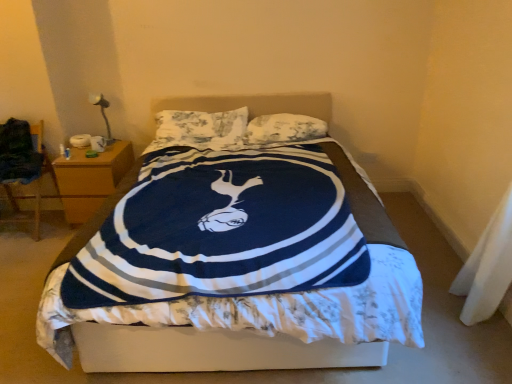
Question: Is white fabric at lower right to the left of fluffy white pillow at center, which is the 1th pillow in right-to-left order, from the viewer's perspective?

Choices:
 (A) no
 (B) yes

Answer: (A)

Question: Can you confirm if white fabric at lower right is bigger than fluffy white pillow at center, which is the 1th pillow in right-to-left order?

Choices:
 (A) no
 (B) yes

Answer: (A)

Question: Does white fabric at lower right have a greater width compared to fluffy white pillow at center, which is the 1th pillow in right-to-left order?

Choices:
 (A) no
 (B) yes

Answer: (A)

Question: Is white fabric at lower right shorter than fluffy white pillow at center, which is the 1th pillow in right-to-left order?

Choices:
 (A) no
 (B) yes

Answer: (B)

Question: From a real-world perspective, is white fabric at lower right under fluffy white pillow at center, which is the 1th pillow in right-to-left order?

Choices:
 (A) yes
 (B) no

Answer: (A)

Question: From a real-world perspective, is metallic silver table lamp at upper left positioned above or below white fabric at lower right?

Choices:
 (A) above
 (B) below

Answer: (A)

Question: In terms of size, does metallic silver table lamp at upper left appear bigger or smaller than white fabric at lower right?

Choices:
 (A) small
 (B) big

Answer: (B)

Question: Is point (104, 120) positioned closer to the camera than point (476, 254)?

Choices:
 (A) closer
 (B) farther

Answer: (B)

Question: In terms of height, does metallic silver table lamp at upper left look taller or shorter compared to white fabric at lower right?

Choices:
 (A) tall
 (B) short

Answer: (A)

Question: Looking at the image, does fluffy white pillow at center, placed as the first pillow when sorted from left to right, seem bigger or smaller compared to fluffy white pillow at center, which is the 1th pillow in right-to-left order?

Choices:
 (A) big
 (B) small

Answer: (A)

Question: In the image, is fluffy white pillow at center, the second pillow viewed from the right, on the left side or the right side of fluffy white pillow at center, which ranks as the second pillow in left-to-right order?

Choices:
 (A) right
 (B) left

Answer: (B)

Question: Is point (182, 135) positioned closer to the camera than point (290, 129)?

Choices:
 (A) closer
 (B) farther

Answer: (B)

Question: Considering the positions of fluffy white pillow at center, the second pillow viewed from the right, and fluffy white pillow at center, which is the 1th pillow in right-to-left order, in the image, is fluffy white pillow at center, the second pillow viewed from the right, wider or thinner than fluffy white pillow at center, which is the 1th pillow in right-to-left order,?

Choices:
 (A) thin
 (B) wide

Answer: (B)

Question: Visually, is wooden nightstand at left positioned to the left or to the right of metallic silver table lamp at upper left?

Choices:
 (A) right
 (B) left

Answer: (A)

Question: From their relative heights in the image, would you say wooden nightstand at left is taller or shorter than metallic silver table lamp at upper left?

Choices:
 (A) tall
 (B) short

Answer: (A)